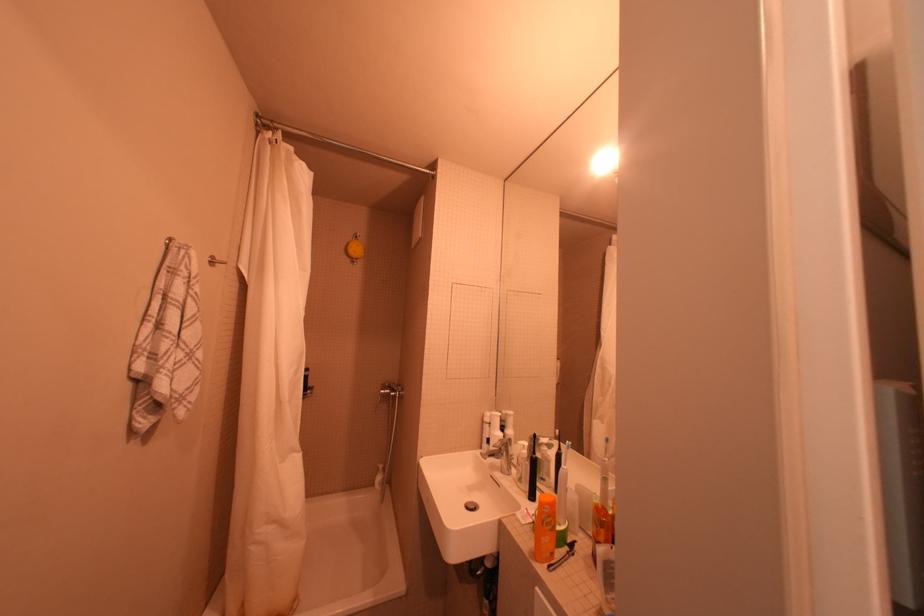
Locate an element on the screen. Image resolution: width=924 pixels, height=616 pixels. orange bottle cap is located at coordinates (544, 528).